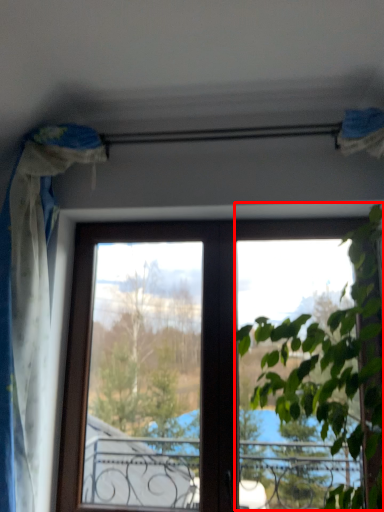
Question: Considering the relative positions of vegetation (annotated by the red box) and curtain in the image provided, where is vegetation (annotated by the red box) located with respect to the staircase?

Choices:
 (A) left
 (B) right

Answer: (B)